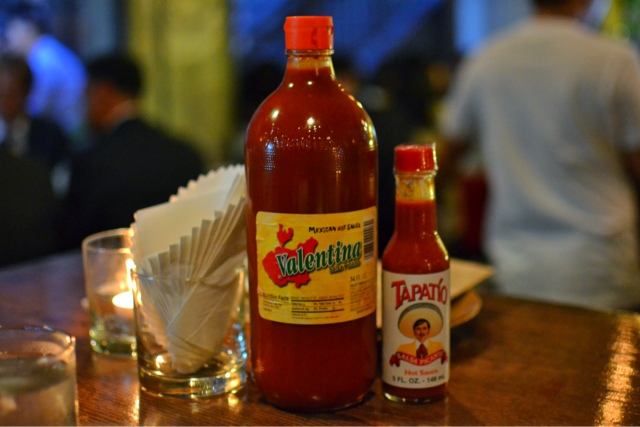
Identify the location of wooden table. (243, 415).